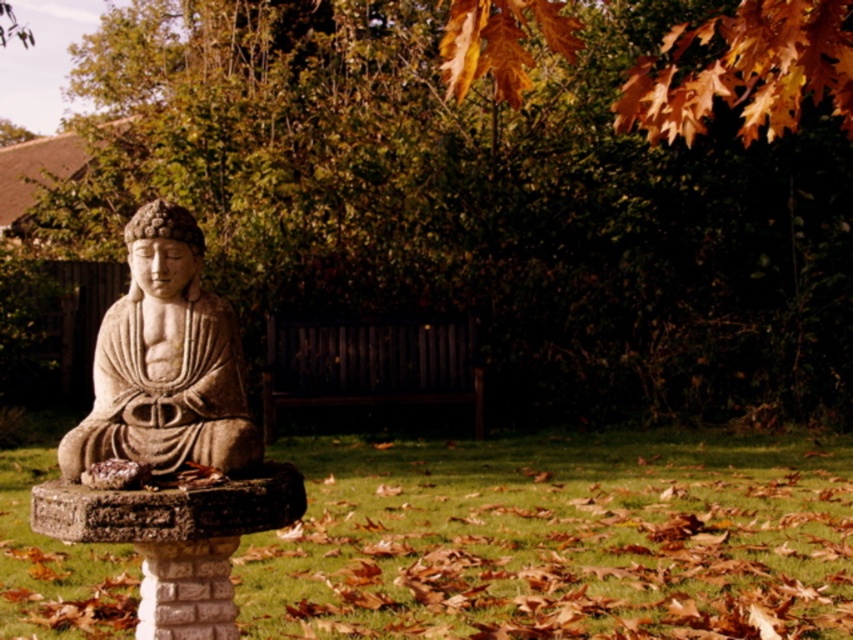
Can you confirm if autumn leaves at upper center is positioned above stone statue at center?

Correct, autumn leaves at upper center is located above stone statue at center.

Measure the distance between autumn leaves at upper center and camera.

The distance of autumn leaves at upper center from camera is 9.65 meters.

Image resolution: width=853 pixels, height=640 pixels. In order to click on autumn leaves at upper center in this screenshot , I will do `click(480, 202)`.

Between autumn leaves at upper center and dark wood bench at center, which one appears on the left side from the viewer's perspective?

dark wood bench at center is more to the left.

Where is `autumn leaves at upper center`? autumn leaves at upper center is located at coordinates (480, 202).

Image resolution: width=853 pixels, height=640 pixels. Identify the location of autumn leaves at upper center. (480, 202).

From the picture: Is stone statue at center positioned behind dark wood bench at center?

No, it is not.

Does stone statue at center have a lesser width compared to dark wood bench at center?

Indeed, stone statue at center has a lesser width compared to dark wood bench at center.

This screenshot has width=853, height=640. Find the location of `stone statue at center`. stone statue at center is located at coordinates (165, 362).